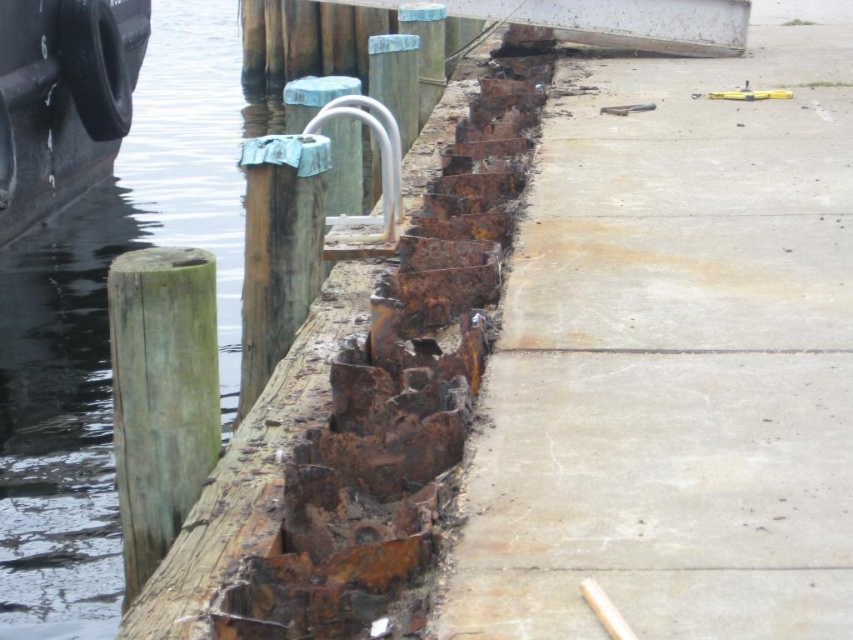
You are a maintenance worker inspecting the dock. You notice the rusty metal water at left and the rusty wood post at center. Which object is positioned to the left of the other?

The rusty metal water at left is to the left of the rusty wood post at center, so the rusty metal water at left is positioned to the left of the other object.

You are a construction inspector evaluating the dock structure. You notice the concrete at right and the green wood post at left. According to safety standards, the concrete must not be placed over any wooden supports to prevent water damage. Is the current placement compliant with these standards?

The concrete at right is positioned over the green wood post at left, which violates the safety standards as wooden supports should not be under concrete to prevent water damage.